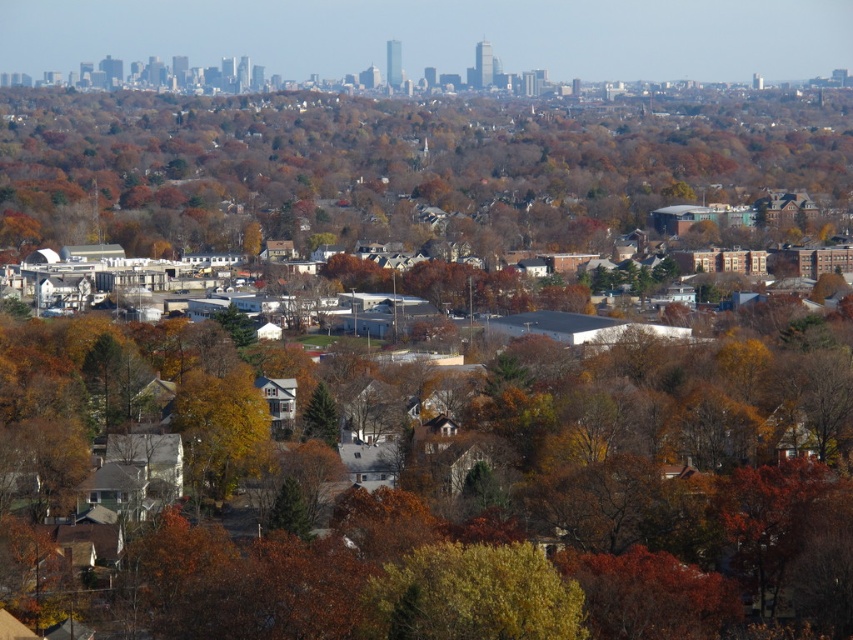
Who is lower down, yellow matte tree at center or green matte tree at center?

Result: yellow matte tree at center is below.

Is yellow matte tree at center above green matte tree at center?

Incorrect, yellow matte tree at center is not positioned above green matte tree at center.

Is point (230, 374) farther from camera compared to point (323, 390)?

Yes.

I want to click on yellow matte tree at center, so click(219, 429).

Is yellow-green leafy tree at center below green matte tree at center?

Yes, yellow-green leafy tree at center is below green matte tree at center.

Consider the image. Can you confirm if yellow-green leafy tree at center is positioned to the right of green matte tree at center?

Correct, you'll find yellow-green leafy tree at center to the right of green matte tree at center.

Who is more distant from viewer, (444, 637) or (306, 403)?

The point (444, 637) is more distant.

Locate an element on the screen. The height and width of the screenshot is (640, 853). yellow-green leafy tree at center is located at coordinates (474, 595).

Between point (419, 628) and point (242, 468), which one is positioned in front?

Point (419, 628) is more forward.

Measure the distance between point (x=433, y=595) and camera.

Point (x=433, y=595) is 651.92 meters from camera.

Who is more forward, (518, 634) or (236, 477)?

Point (518, 634) is in front.

Locate an element on the screen. This screenshot has width=853, height=640. yellow-green leafy tree at center is located at coordinates (474, 595).